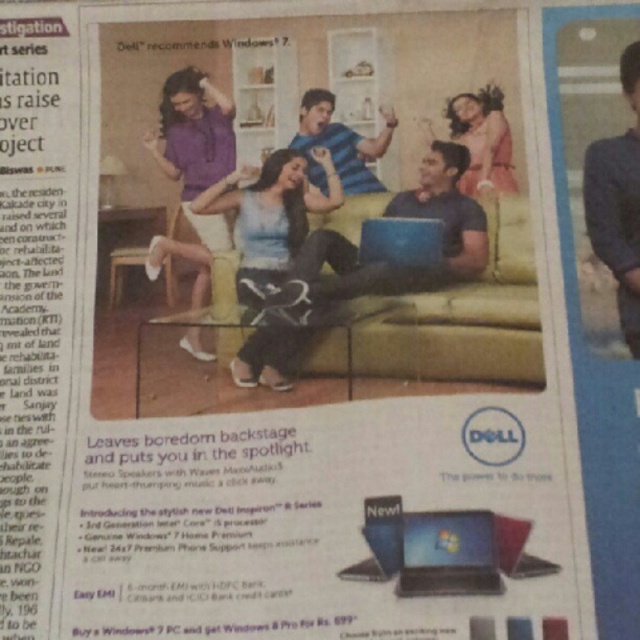
You are a photographer standing at the center of the living room scene in the image. You want to take a closeup shot of the pink fabric dress at upper right without moving your position. Can you estimate if the dress is within the typical focus range of a standard camera lens?

The pink fabric dress at upper right is 26.05 inches away from the camera. A standard camera lens typically has a minimum focusing distance of around 12 inches. Since 26.05 inches is greater than 12 inches, the dress is within the focus range, so you can take a clear closeup shot.

You are standing at the bottom of the newspaper page and looking up at the advertisement. Which of the two points, point (424,522) or point (420,262), is closer to you?

Point (424,522) is in front of point (420,262), so it is closer to you.

You are designing a display for an electronics store and need to arrange the black glossy laptop at lower center and the matte black laptop at center. Since space is limited, you want to know which one takes up more vertical space. Which laptop should you place on the shelf first to optimize space?

The black glossy laptop at lower center is much taller than the matte black laptop at center, so you should place the matte black laptop at center first to save vertical space for the taller laptop.